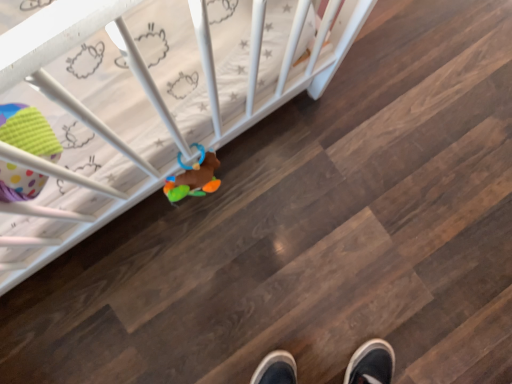
Question: Should I look upward or downward to see white plastic crib at upper left?

Choices:
 (A) down
 (B) up

Answer: (B)

Question: Can you confirm if white plastic crib at upper left is bigger than polka dot fabric toy at left, marked as the first toy in a left-to-right arrangement?

Choices:
 (A) no
 (B) yes

Answer: (B)

Question: Does white plastic crib at upper left come in front of polka dot fabric toy at left, which ranks as the 2th toy in right-to-left order?

Choices:
 (A) no
 (B) yes

Answer: (A)

Question: Can you confirm if white plastic crib at upper left is positioned to the left of polka dot fabric toy at left, which is counted as the first toy, starting from the front?

Choices:
 (A) yes
 (B) no

Answer: (B)

Question: From a real-world perspective, is white plastic crib at upper left located beneath polka dot fabric toy at left, acting as the 2th toy starting from the back?

Choices:
 (A) yes
 (B) no

Answer: (A)

Question: Is white plastic crib at upper left smaller than polka dot fabric toy at left, acting as the 2th toy starting from the back?

Choices:
 (A) no
 (B) yes

Answer: (A)

Question: Considering the relative sizes of white plastic crib at upper left and polka dot fabric toy at left, acting as the 2th toy starting from the back, in the image provided, is white plastic crib at upper left shorter than polka dot fabric toy at left, acting as the 2th toy starting from the back,?

Choices:
 (A) no
 (B) yes

Answer: (B)

Question: Considering the relative sizes of multicolored plush toy at center, which is the second toy in front-to-back order, and polka dot fabric toy at left, marked as the first toy in a left-to-right arrangement, in the image provided, is multicolored plush toy at center, which is the second toy in front-to-back order, shorter than polka dot fabric toy at left, marked as the first toy in a left-to-right arrangement,?

Choices:
 (A) yes
 (B) no

Answer: (A)

Question: Is polka dot fabric toy at left, which is counted as the first toy, starting from the front, at the back of multicolored plush toy at center, placed as the 1th toy when sorted from right to left?

Choices:
 (A) yes
 (B) no

Answer: (B)

Question: Is multicolored plush toy at center, the 1th toy when ordered from back to front, not inside polka dot fabric toy at left, acting as the 2th toy starting from the back?

Choices:
 (A) no
 (B) yes

Answer: (B)

Question: From a real-world perspective, is multicolored plush toy at center, which is the second toy in front-to-back order, on polka dot fabric toy at left, marked as the first toy in a left-to-right arrangement?

Choices:
 (A) no
 (B) yes

Answer: (A)

Question: Is multicolored plush toy at center, which is the second toy in front-to-back order, thinner than polka dot fabric toy at left, acting as the 2th toy starting from the back?

Choices:
 (A) no
 (B) yes

Answer: (B)

Question: Does multicolored plush toy at center, placed as the second toy when sorted from left to right, turn towards polka dot fabric toy at left, which ranks as the 2th toy in right-to-left order?

Choices:
 (A) no
 (B) yes

Answer: (A)

Question: From a real-world perspective, is multicolored plush toy at center, placed as the second toy when sorted from left to right, below white plastic crib at upper left?

Choices:
 (A) yes
 (B) no

Answer: (B)